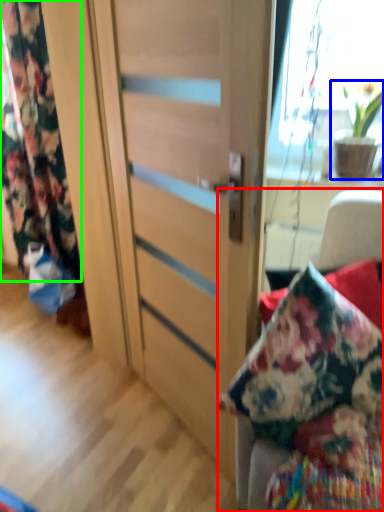
Question: Based on their relative distances, which object is farther from furniture (highlighted by a red box)? Choose from houseplant (highlighted by a blue box) and curtain (highlighted by a green box).

Choices:
 (A) houseplant
 (B) curtain

Answer: (B)